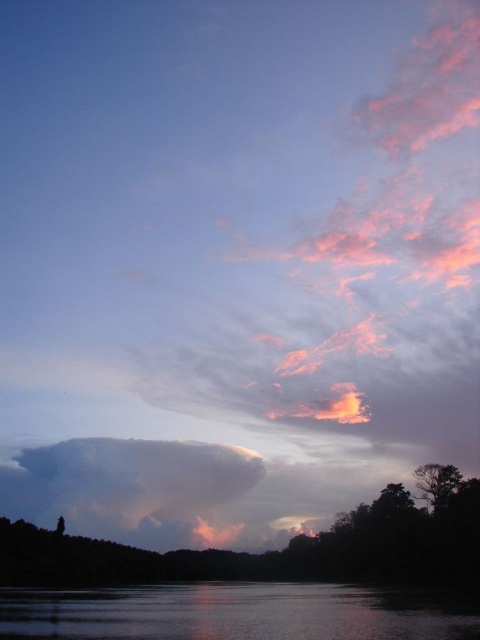
You are an artist trying to paint the sunset scene. You want to ensure that the glistening water at lower center and the smokey gray cloud at center are positioned correctly. Based on the scene description, which object should appear closer to the viewer?

The glistening water at lower center should appear closer to the viewer because it is positioned in front of the smokey gray cloud at center.

You are standing at the edge of the water in the sunset scene. You notice a point marked at coordinates point [233,612]. Based on the scene description, what does this point likely represent?

The point [233,612] likely represents the glistening water at lower center as described in the scene.